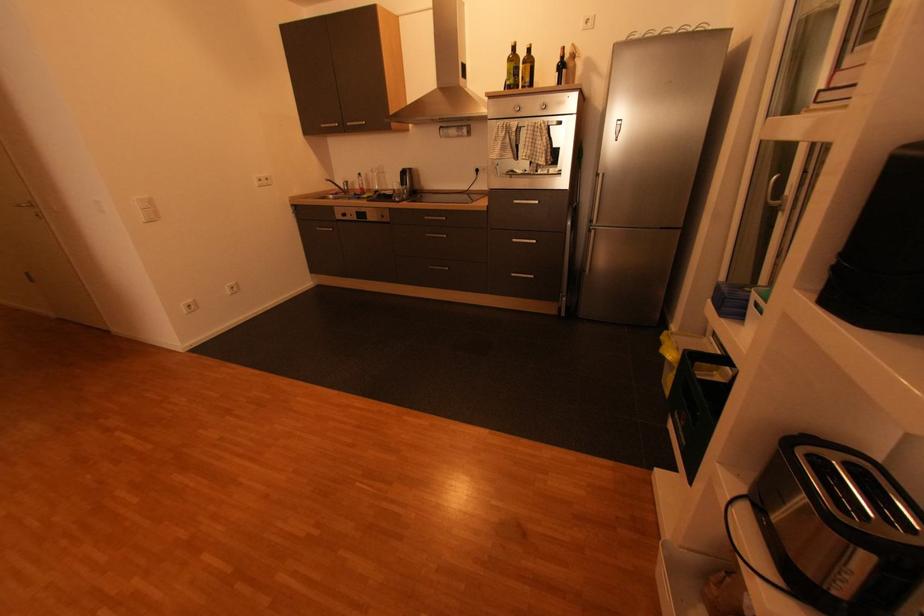
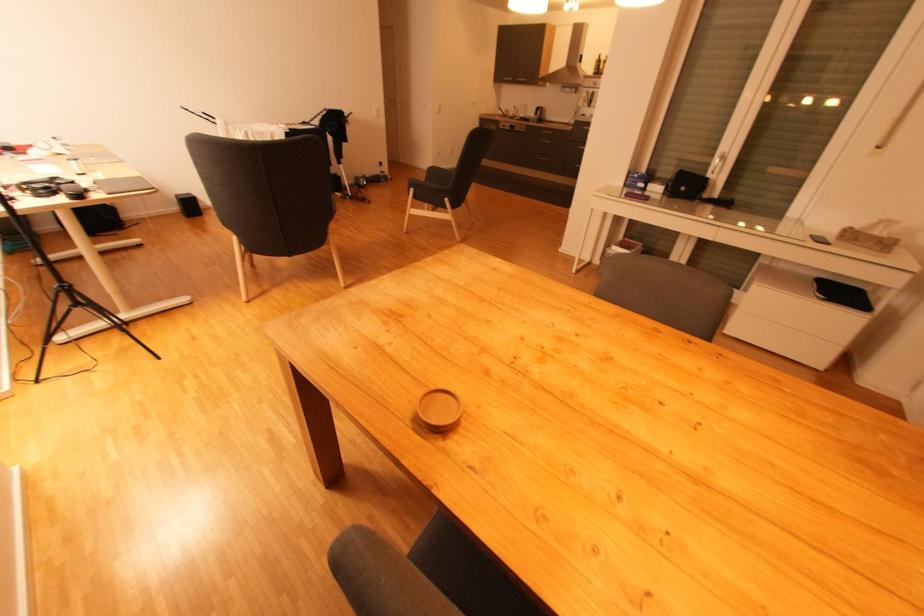
Question: What movement of the cameraman would produce the second image?

Choices:
 (A) Left
 (B) Right
 (C) Forward
 (D) Backward

Answer: (D)